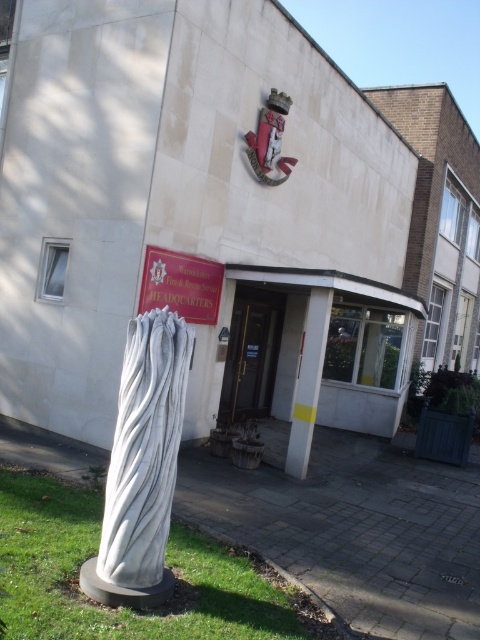
Can you confirm if white marble column at lower left is bigger than metallic gold door at center?

No, white marble column at lower left is not bigger than metallic gold door at center.

Does white marble column at lower left come behind metallic gold door at center?

No, it is not.

This screenshot has height=640, width=480. What do you see at coordinates (143, 465) in the screenshot?
I see `white marble column at lower left` at bounding box center [143, 465].

Locate an element on the screen. This screenshot has height=640, width=480. white marble column at lower left is located at coordinates (143, 465).

Who is higher up, white marble column at lower left or white marble pillar at center?

white marble pillar at center is above.

Does white marble column at lower left have a lesser height compared to white marble pillar at center?

Indeed, white marble column at lower left has a lesser height compared to white marble pillar at center.

Is point (117, 492) farther from viewer compared to point (291, 435)?

No, (117, 492) is in front of (291, 435).

Locate an element on the screen. white marble column at lower left is located at coordinates (143, 465).

Is green grass at lower left in front of white marble pillar at center?

Yes, it is in front of white marble pillar at center.

Where is `green grass at lower left`? This screenshot has width=480, height=640. green grass at lower left is located at coordinates (124, 608).

Identify the location of green grass at lower left. (124, 608).